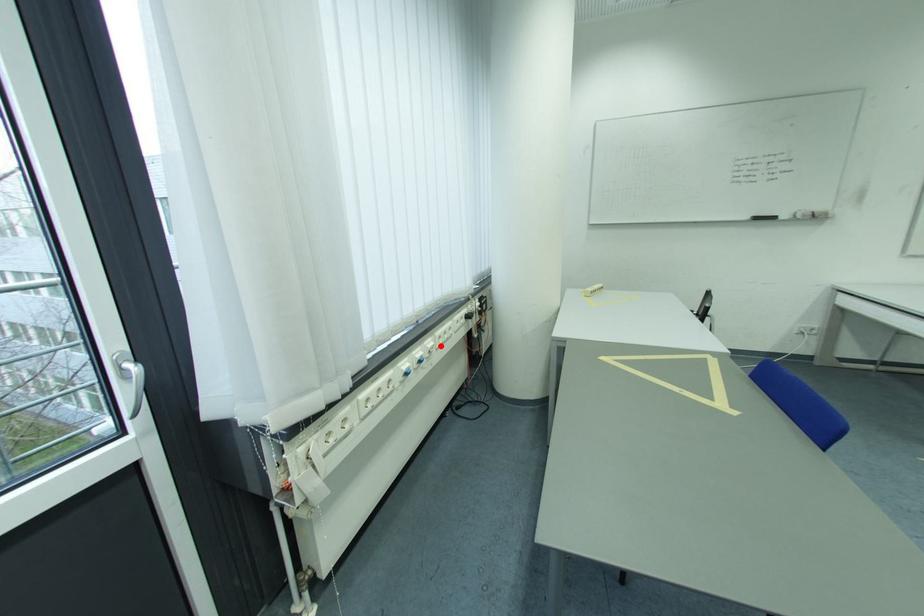
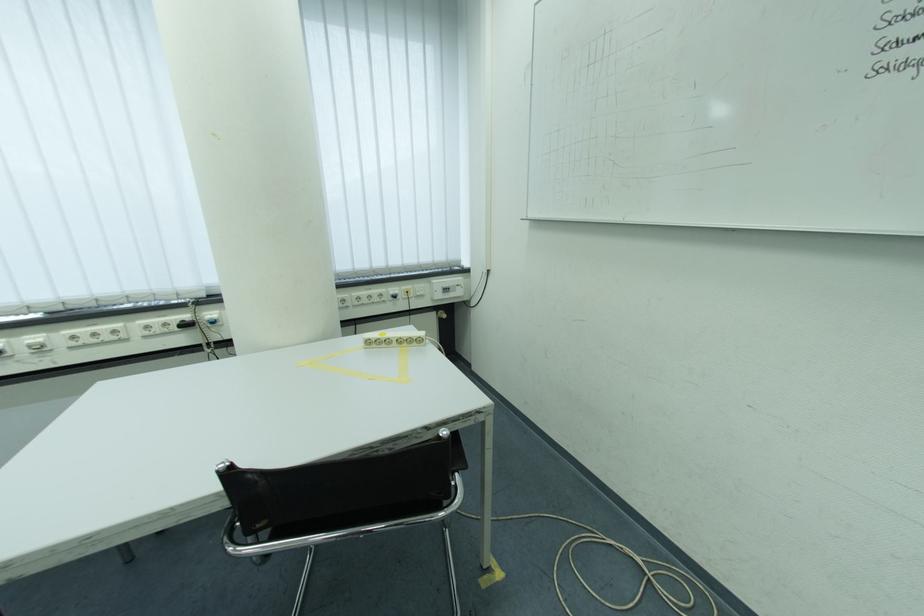
In the second image, find the point that corresponds to the highlighted location in the first image.

(50, 342)